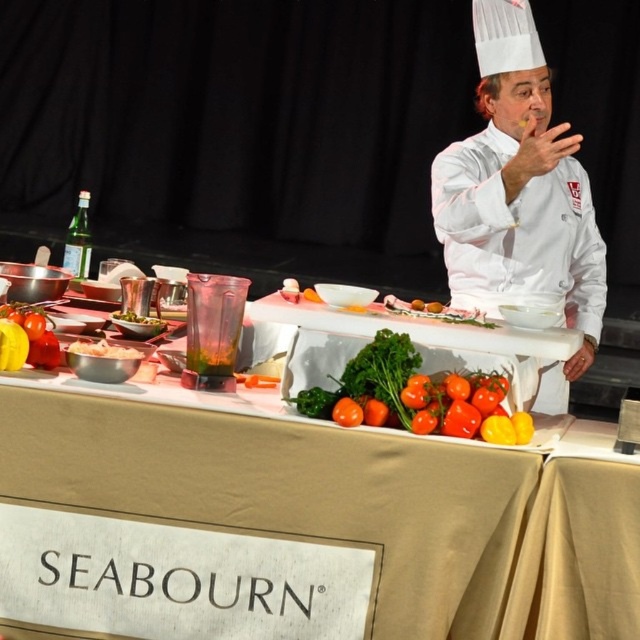
Question: Which of these objects is positioned closest to the yellow matte pepper at left?

Choices:
 (A) white chef coat at upper right
 (B) glossy red tomatoes at center

Answer: (B)

Question: Among these objects, which one is nearest to the camera?

Choices:
 (A) yellow matte pepper at left
 (B) green leafy vegetables at center
 (C) glossy red tomatoes at center

Answer: (C)

Question: Is glossy red tomatoes at center positioned behind white glossy bowl at center?

Choices:
 (A) yes
 (B) no

Answer: (B)

Question: Does yellow matte pepper at left appear on the left side of white glossy bowl at center?

Choices:
 (A) no
 (B) yes

Answer: (B)

Question: From the image, what is the correct spatial relationship of white chef coat at upper right in relation to yellow matte pepper at left?

Choices:
 (A) right
 (B) left

Answer: (A)

Question: Which object is farther from the camera taking this photo?

Choices:
 (A) white chef coat at upper right
 (B) yellow matte pepper at left
 (C) white glossy bowl at center

Answer: (A)